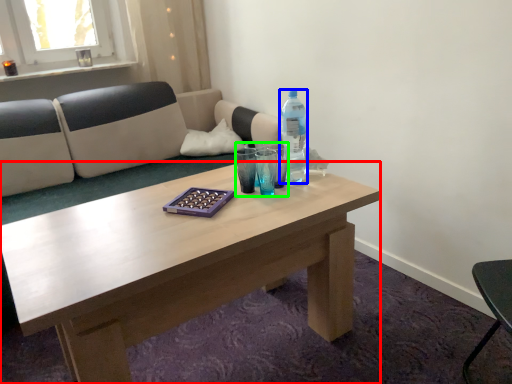
Question: Which object is positioned farthest from coffee table (highlighted by a red box)? Select from bottle (highlighted by a blue box) and mineral water (highlighted by a green box).

Choices:
 (A) bottle
 (B) mineral water

Answer: (A)